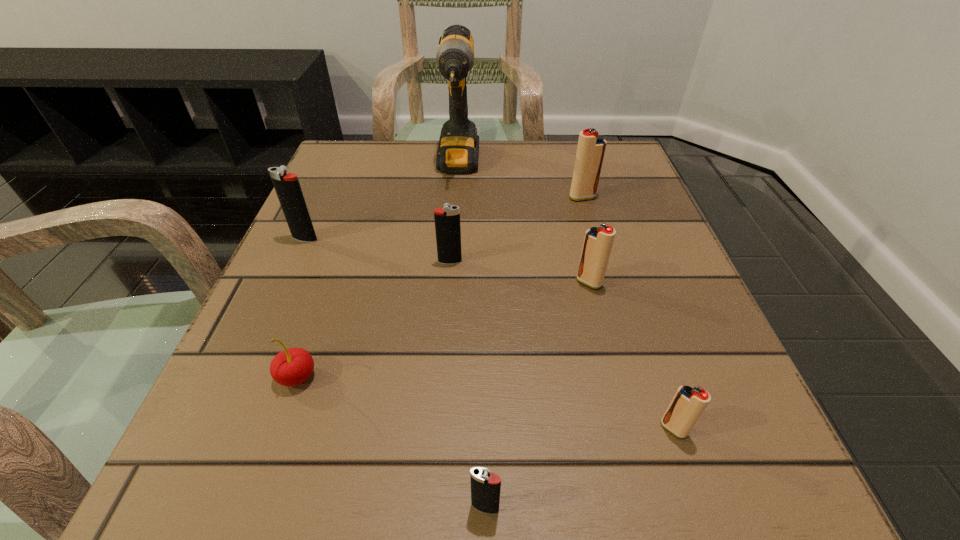
Find the location of `vacant area that lies between the farthest igniter and the second farthest black igniter`. vacant area that lies between the farthest igniter and the second farthest black igniter is located at coordinates (516, 230).

The image size is (960, 540). Identify the location of vacant area that lies between the second nearest igniter and the tallest object. (565, 297).

In order to click on vacant area between the smallest black igniter and the drill in this screenshot , I will do `click(471, 336)`.

Find the location of a particular element. vacant area that lies between the farthest igniter and the red cherry is located at coordinates (440, 287).

Find the location of a particular element. Image resolution: width=960 pixels, height=540 pixels. unoccupied position between the leftmost igniter and the tallest object is located at coordinates point(381,202).

What are the coordinates of `object identified as the closest to the leftmost igniter` in the screenshot? It's located at (447, 220).

This screenshot has height=540, width=960. In order to click on object that can be found as the closest to the second object from left to right in this screenshot , I will do `click(447, 220)`.

Select which igniter appears as the second closest to the second nearest object. Please provide its 2D coordinates. Your answer should be formatted as a tuple, i.e. [(x, y)], where the tuple contains the x and y coordinates of a point satisfying the conditions above.

[(598, 242)]

The height and width of the screenshot is (540, 960). I want to click on igniter that stands as the fifth closest to the nearest object, so click(x=591, y=147).

Locate an element on the screen. Image resolution: width=960 pixels, height=540 pixels. the closest red igniter to the leftmost igniter is located at coordinates (598, 242).